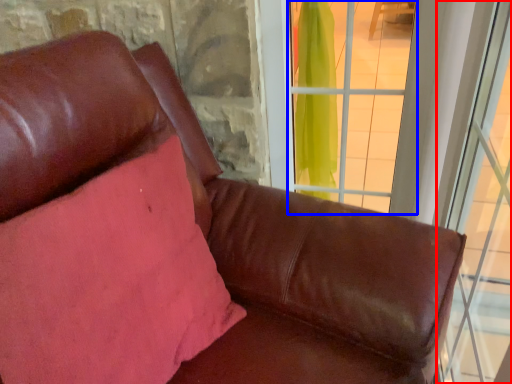
Question: Which of the following is the closest to the observer, window (highlighted by a red box) or window (highlighted by a blue box)?

Choices:
 (A) window
 (B) window

Answer: (A)